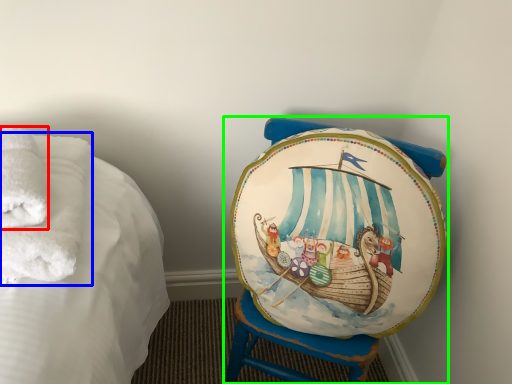
Question: Estimate the real-world distances between objects in this image. Which object is closer to bath towel (highlighted by a red box), bath towel (highlighted by a blue box) or furniture (highlighted by a green box)?

Choices:
 (A) bath towel
 (B) furniture

Answer: (A)